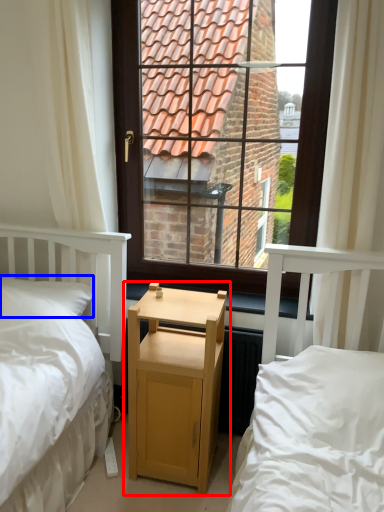
Question: Which point is further to the camera, nightstand (highlighted by a red box) or pillow (highlighted by a blue box)?

Choices:
 (A) nightstand
 (B) pillow

Answer: (B)